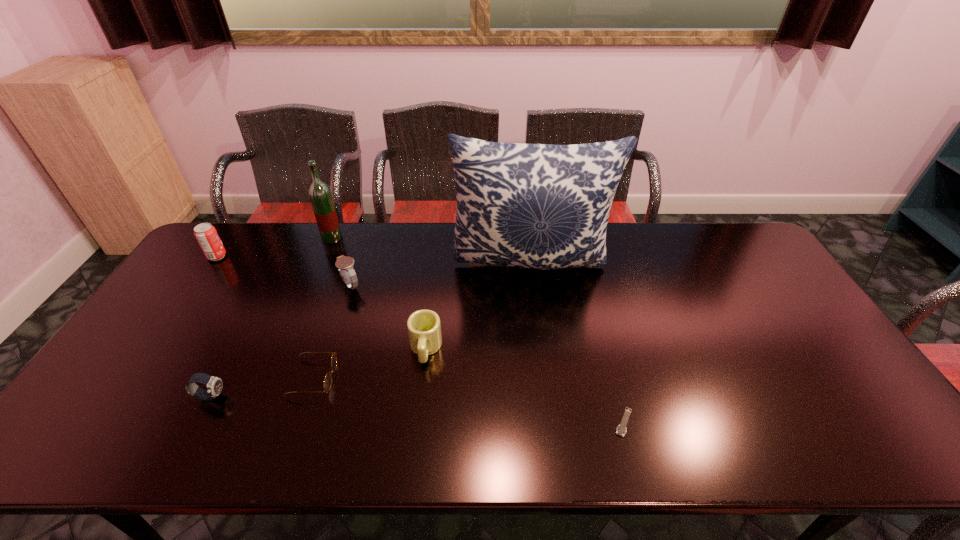
The height and width of the screenshot is (540, 960). Find the location of `free space at the right edge`. free space at the right edge is located at coordinates (762, 314).

In the image, there is a desktop. Where is `vacant space at the far left corner`? This screenshot has height=540, width=960. vacant space at the far left corner is located at coordinates (247, 227).

This screenshot has width=960, height=540. Identify the location of free space at the near left corner of the desktop. (85, 429).

Locate an element on the screen. vacant region at the far right corner of the desktop is located at coordinates (743, 236).

At what (x,y) coordinates should I click in order to perform the action: click on unoccupied position between the third object from right to left and the rightmost watch. Please return your answer as a coordinate pair (x, y). This screenshot has height=540, width=960. Looking at the image, I should click on [525, 386].

Where is `empty location between the liquor and the cushion`? empty location between the liquor and the cushion is located at coordinates (431, 252).

This screenshot has width=960, height=540. In order to click on free spot between the sunglasses and the second watch from right to left in this screenshot , I will do `click(332, 332)`.

This screenshot has width=960, height=540. Find the location of `free area in between the second tallest watch and the sixth object from right to left`. free area in between the second tallest watch and the sixth object from right to left is located at coordinates (272, 317).

What are the coordinates of `unoccupied area between the leftmost watch and the tallest object` in the screenshot? It's located at (371, 330).

This screenshot has width=960, height=540. Find the location of `free spot between the second tallest object and the second nearest watch`. free spot between the second tallest object and the second nearest watch is located at coordinates (272, 317).